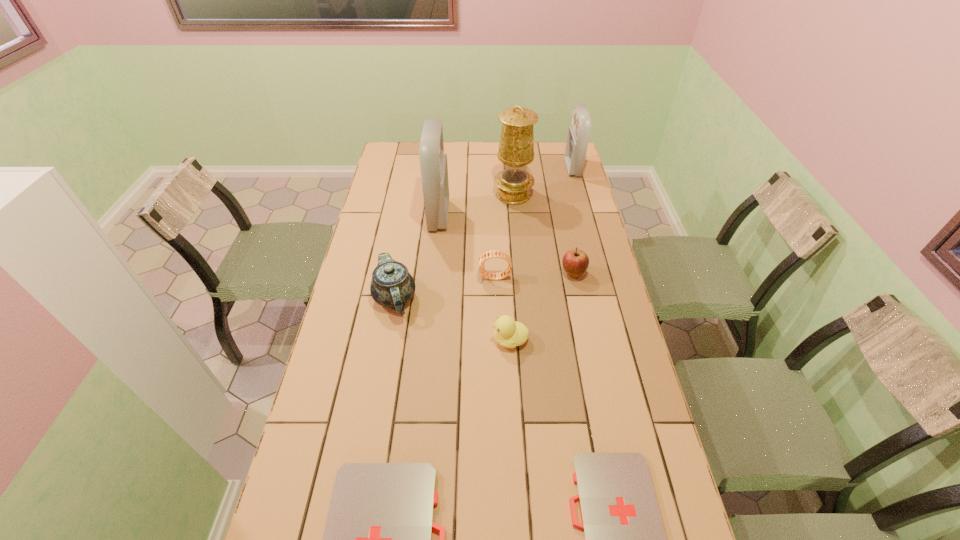
Locate an element on the screen. This screenshot has height=540, width=960. oil lamp is located at coordinates (516, 148).

Find the location of a particular element. The image size is (960, 540). the tallest first-aid kit is located at coordinates (433, 162).

You are a GUI agent. You are given a task and a screenshot of the screen. Output one action in this format:
    pyautogui.click(x=<x>, y=<y>)
    Task: Click on the nearer red first-aid kit
    
    Given the screenshot: What is the action you would take?
    pyautogui.click(x=433, y=162)

In order to click on the third tallest object in this screenshot , I will do `click(578, 133)`.

At what (x,y) coordinates should I click in order to perform the action: click on the farthest first-aid kit. Please return your answer as a coordinate pair (x, y). This screenshot has height=540, width=960. Looking at the image, I should click on (578, 133).

This screenshot has width=960, height=540. I want to click on the sixth shortest object, so click(392, 286).

Locate an element on the screen. The width and height of the screenshot is (960, 540). apple is located at coordinates 575,262.

Identify the location of black watch. This screenshot has width=960, height=540. (487, 255).

The width and height of the screenshot is (960, 540). I want to click on the third nearest object, so click(x=508, y=333).

You are a GUI agent. You are given a task and a screenshot of the screen. Output one action in this format:
    pyautogui.click(x=<x>, y=<y>)
    Task: Click on the duckling
    
    Given the screenshot: What is the action you would take?
    pyautogui.click(x=508, y=333)